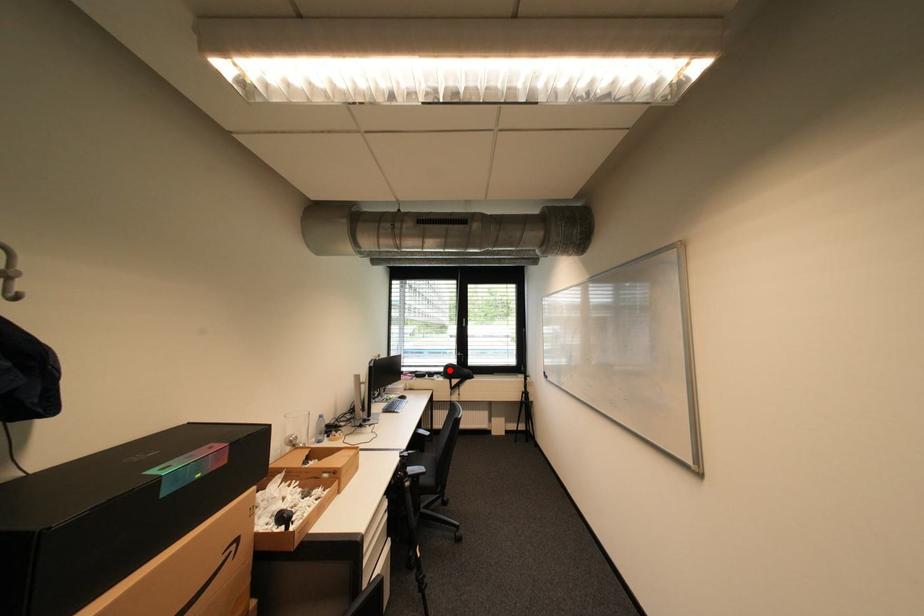
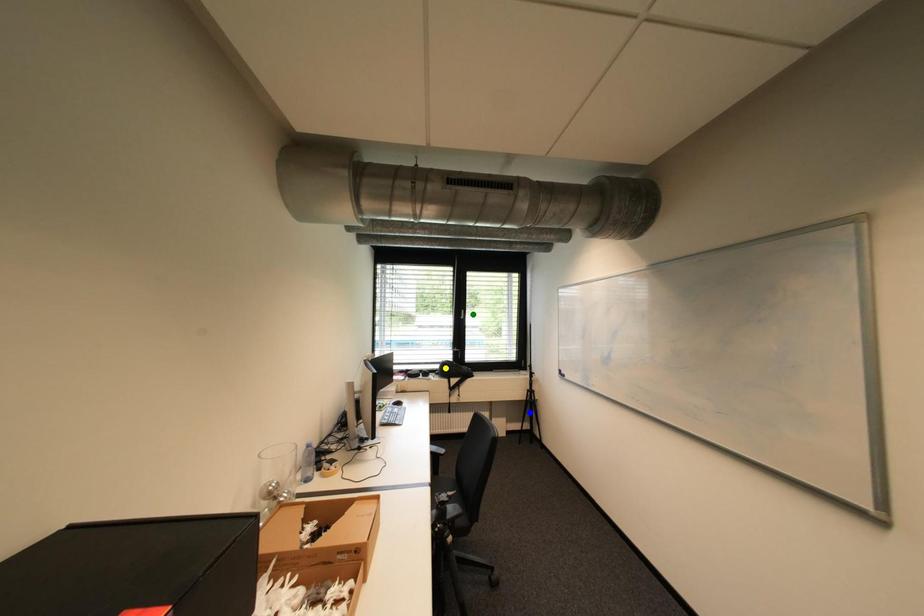
Question: I am providing you with two images of the same scene from different viewpoints. A red point is marked on the first image. You are given multiple points on the second image. Which point in image 2 represents the same 3d spot as the red point in image 1?

Choices:
 (A) green point
 (B) blue point
 (C) yellow point

Answer: (C)